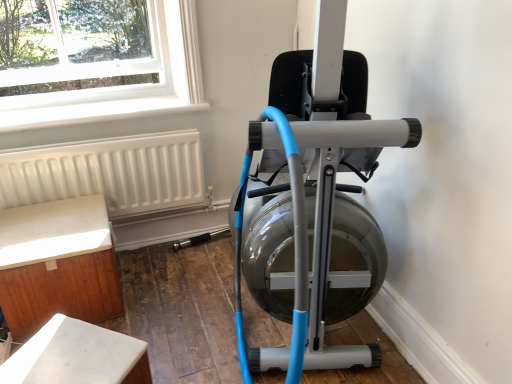
Question: Looking at their shapes, would you say matte silver stationary bicycle at center is wider or thinner than white marble table at lower left, which is counted as the second furniture, starting from the back?

Choices:
 (A) thin
 (B) wide

Answer: (B)

Question: From the image's perspective, is matte silver stationary bicycle at center located above or below white marble table at lower left, which is counted as the second furniture, starting from the back?

Choices:
 (A) above
 (B) below

Answer: (A)

Question: Which object is the closest to the white matte radiator at lower left?

Choices:
 (A) white wood cabinet at lower left, which is counted as the first furniture, starting from the back
 (B) matte silver stationary bicycle at center
 (C) white marble table at lower left, which is counted as the second furniture, starting from the back

Answer: (A)

Question: Which of these objects is positioned farthest from the white marble table at lower left, which is counted as the second furniture, starting from the back?

Choices:
 (A) white wood cabinet at lower left, which is counted as the first furniture, starting from the back
 (B) white matte radiator at lower left
 (C) matte silver stationary bicycle at center

Answer: (B)